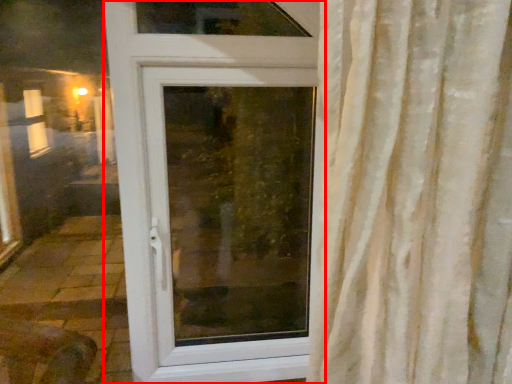
Question: From the image's perspective, what is the correct spatial relationship of door (annotated by the red box) in relation to window screen?

Choices:
 (A) above
 (B) below

Answer: (A)